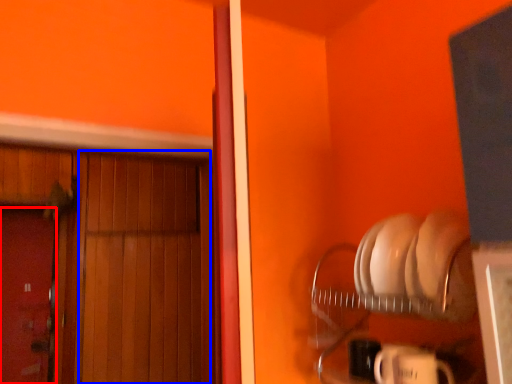
Question: Which object appears closest to the camera in this image, door (highlighted by a red box) or door (highlighted by a blue box)?

Choices:
 (A) door
 (B) door

Answer: (B)